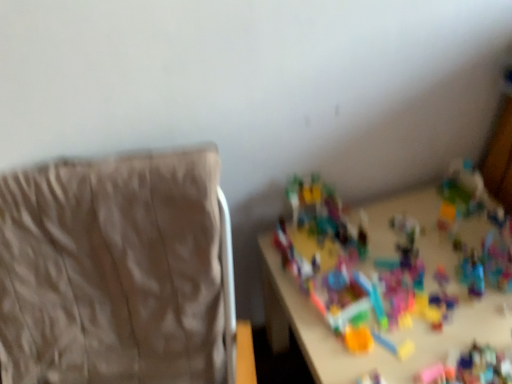
Question: Is beige fabric chair at left wider or thinner than multicolored plastic toys at center?

Choices:
 (A) thin
 (B) wide

Answer: (B)

Question: In the image, is beige fabric chair at left positioned in front of or behind multicolored plastic toys at center?

Choices:
 (A) front
 (B) behind

Answer: (A)

Question: From their relative heights in the image, would you say beige fabric chair at left is taller or shorter than multicolored plastic toys at center?

Choices:
 (A) tall
 (B) short

Answer: (A)

Question: Considering the positions of multicolored plastic toys at center and beige fabric chair at left in the image, is multicolored plastic toys at center bigger or smaller than beige fabric chair at left?

Choices:
 (A) small
 (B) big

Answer: (A)

Question: Considering the positions of multicolored plastic toys at center and beige fabric chair at left in the image, is multicolored plastic toys at center taller or shorter than beige fabric chair at left?

Choices:
 (A) tall
 (B) short

Answer: (B)

Question: Is multicolored plastic toys at center in front of or behind beige fabric chair at left in the image?

Choices:
 (A) behind
 (B) front

Answer: (A)

Question: Considering the positions of point (485, 210) and point (82, 289), is point (485, 210) closer or farther from the camera than point (82, 289)?

Choices:
 (A) farther
 (B) closer

Answer: (A)